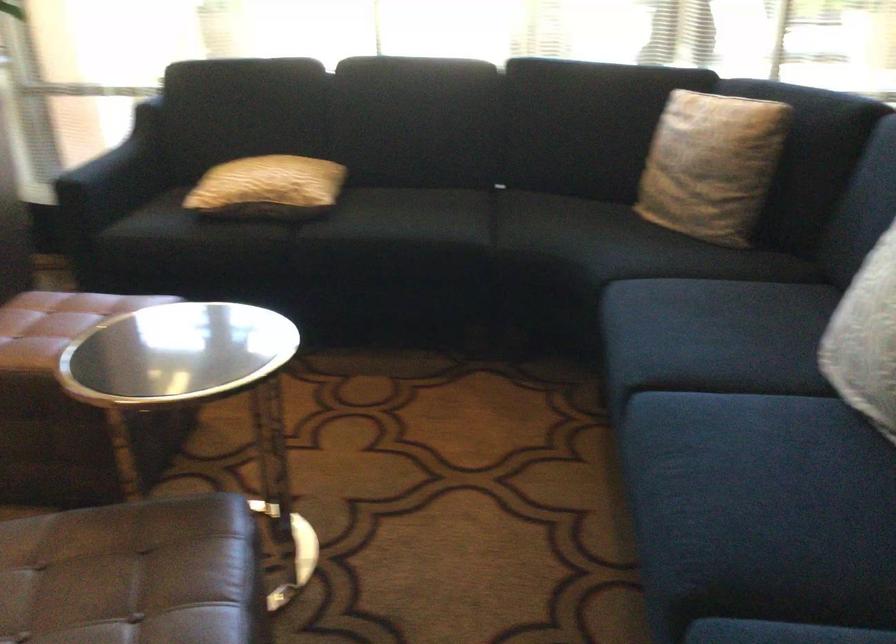
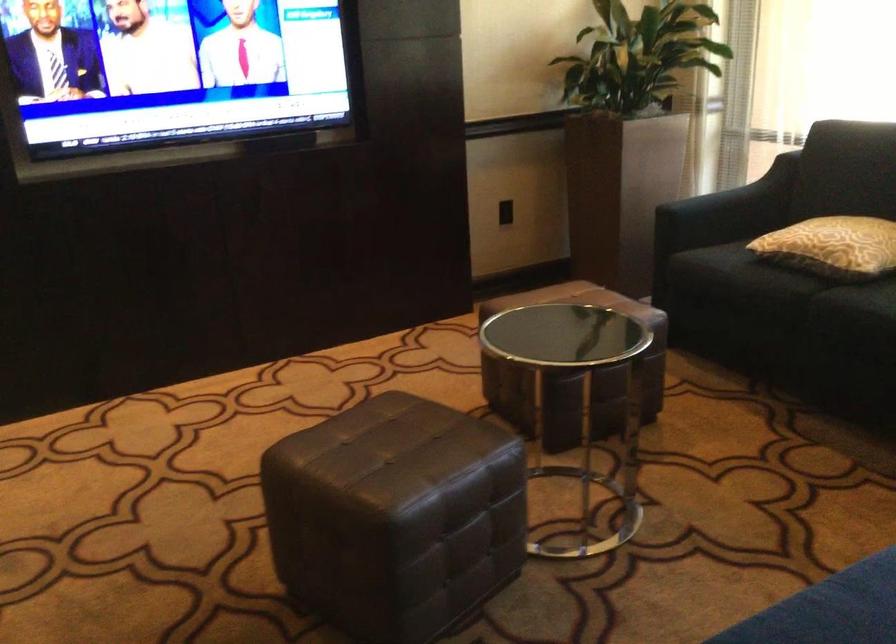
Where in the second image is the point corresponding to point (130, 160) from the first image?

(742, 196)